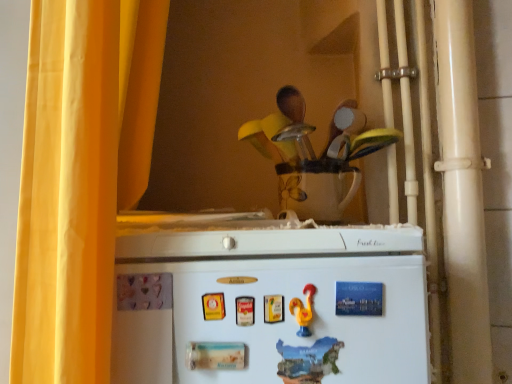
Question: Considering the relative sizes of yellow fabric curtain at left and blue paper magnet at upper center, which is the first magnet from back to front, in the image provided, is yellow fabric curtain at left bigger than blue paper magnet at upper center, which is the first magnet from back to front,?

Choices:
 (A) yes
 (B) no

Answer: (A)

Question: Considering the relative sizes of yellow fabric curtain at left and blue paper magnet at upper center, the first magnet from the right, in the image provided, is yellow fabric curtain at left thinner than blue paper magnet at upper center, the first magnet from the right,?

Choices:
 (A) no
 (B) yes

Answer: (A)

Question: Is yellow fabric curtain at left closer to camera compared to blue paper magnet at upper center, the second magnet from the bottom?

Choices:
 (A) yes
 (B) no

Answer: (A)

Question: Is yellow fabric curtain at left turned away from blue paper magnet at upper center, the second magnet from the bottom?

Choices:
 (A) no
 (B) yes

Answer: (A)

Question: Does yellow fabric curtain at left have a greater height compared to blue paper magnet at upper center, the second magnet from the bottom?

Choices:
 (A) yes
 (B) no

Answer: (A)

Question: From a real-world perspective, is yellow fabric curtain at left under blue paper magnet at upper center, which is the first magnet from back to front?

Choices:
 (A) yes
 (B) no

Answer: (B)

Question: Is yellow fabric curtain at left positioned before wooden spoon set at upper center?

Choices:
 (A) yes
 (B) no

Answer: (A)

Question: From the image's perspective, is yellow fabric curtain at left under wooden spoon set at upper center?

Choices:
 (A) yes
 (B) no

Answer: (A)

Question: Is yellow fabric curtain at left to the left of wooden spoon set at upper center from the viewer's perspective?

Choices:
 (A) yes
 (B) no

Answer: (A)

Question: Can you confirm if yellow fabric curtain at left is shorter than wooden spoon set at upper center?

Choices:
 (A) yes
 (B) no

Answer: (B)

Question: Considering the relative sizes of yellow fabric curtain at left and wooden spoon set at upper center in the image provided, is yellow fabric curtain at left bigger than wooden spoon set at upper center?

Choices:
 (A) yes
 (B) no

Answer: (A)

Question: Is yellow fabric curtain at left positioned far away from wooden spoon set at upper center?

Choices:
 (A) yes
 (B) no

Answer: (B)

Question: Could blue paper magnet at upper center, acting as the 2th magnet starting from the left, be considered to be inside white matte refrigerator at lower center?

Choices:
 (A) no
 (B) yes

Answer: (B)